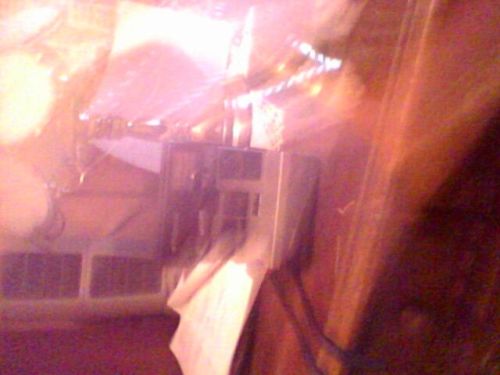
Where is `curtain`? Image resolution: width=500 pixels, height=375 pixels. curtain is located at coordinates (359, 287).